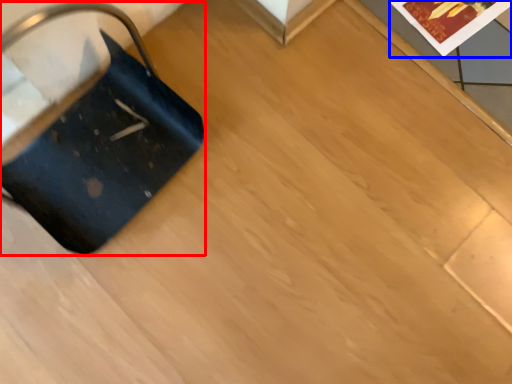
Question: Which of the following is the closest to the observer, luggage (highlighted by a red box) or postcard (highlighted by a blue box)?

Choices:
 (A) luggage
 (B) postcard

Answer: (A)